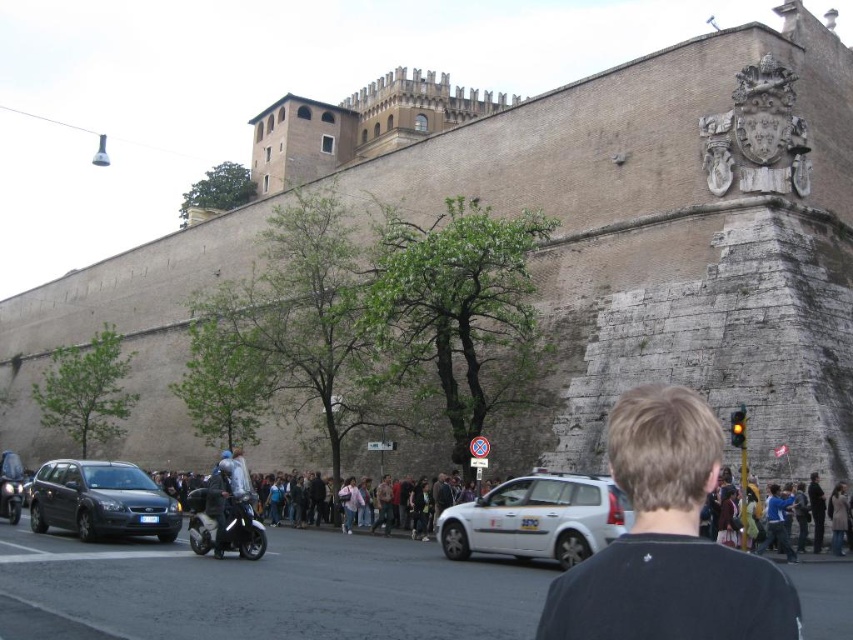
Is point (497, 540) behind point (77, 492)?

No, it is in front of (77, 492).

What do you see at coordinates (537, 518) in the screenshot? I see `white matte hatchback at center` at bounding box center [537, 518].

Is point (584, 502) in front of point (71, 528)?

Yes, point (584, 502) is in front of point (71, 528).

Image resolution: width=853 pixels, height=640 pixels. I want to click on white matte hatchback at center, so click(x=537, y=518).

Does white matte hatchback at center appear on the left side of dark blue leather jacket at center?

No, white matte hatchback at center is not to the left of dark blue leather jacket at center.

This screenshot has width=853, height=640. Find the location of `white matte hatchback at center`. white matte hatchback at center is located at coordinates (537, 518).

The image size is (853, 640). Identify the location of white matte hatchback at center. (537, 518).

Between point (82, 520) and point (204, 513), which one is positioned behind?

Positioned behind is point (82, 520).

I want to click on matte black car at lower left, so click(102, 500).